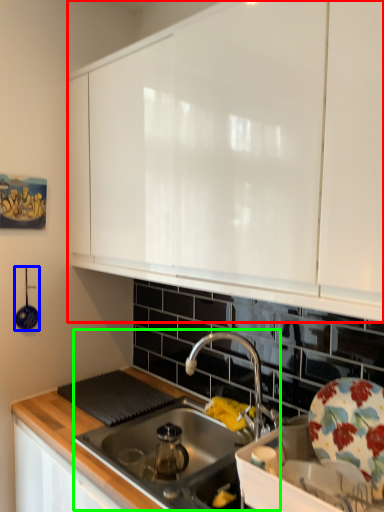
Question: Based on their relative distances, which object is farther from cabinetry (highlighted by a red box)? Choose from appliance (highlighted by a blue box) and sink (highlighted by a green box).

Choices:
 (A) appliance
 (B) sink

Answer: (A)